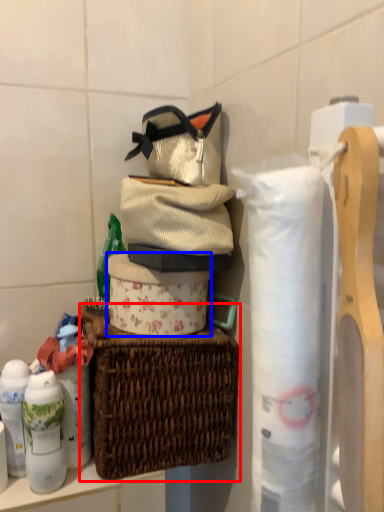
Question: Which of the following is the closest to the observer, picnic basket (highlighted by a red box) or toilet paper (highlighted by a blue box)?

Choices:
 (A) picnic basket
 (B) toilet paper

Answer: (A)